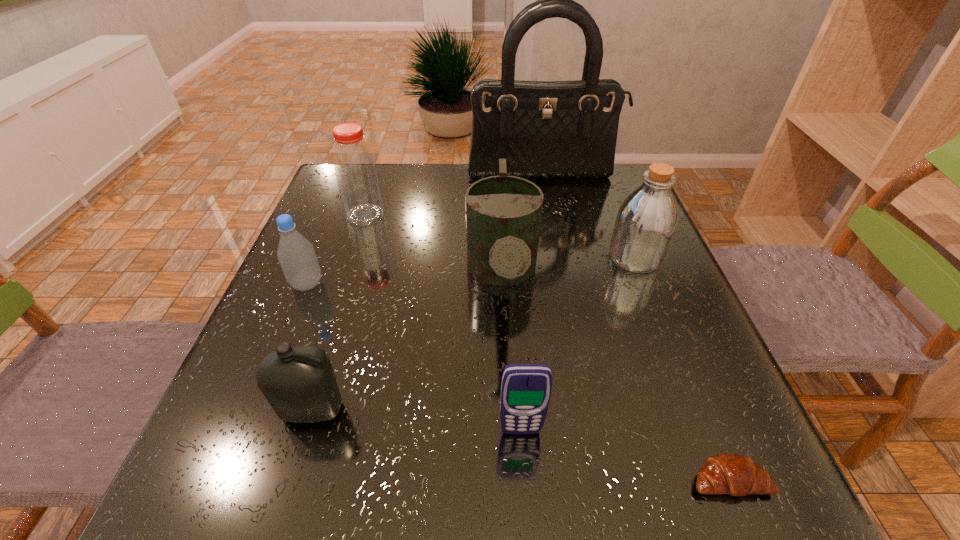
Identify the location of bottle that is at the right edge. Image resolution: width=960 pixels, height=540 pixels. (646, 221).

Find the location of a particular element. Image resolution: width=960 pixels, height=540 pixels. crescent roll present at the right edge is located at coordinates (736, 475).

What are the coordinates of `object situated at the far left corner` in the screenshot? It's located at (356, 174).

I want to click on object that is positioned at the far right corner, so click(x=544, y=129).

Image resolution: width=960 pixels, height=540 pixels. In order to click on object at the near right corner in this screenshot , I will do `click(736, 475)`.

Locate an element on the screen. The height and width of the screenshot is (540, 960). free space at the far edge of the desktop is located at coordinates (445, 189).

Where is `free space at the near edge of the desktop`? This screenshot has width=960, height=540. free space at the near edge of the desktop is located at coordinates (540, 468).

At what (x,y) coordinates should I click in order to perform the action: click on vacant region at the left edge of the desktop. Please return your answer as a coordinate pair (x, y). This screenshot has width=960, height=540. Looking at the image, I should click on (348, 279).

At what (x,y) coordinates should I click in order to perform the action: click on free point at the right edge. Please return your answer as a coordinate pair (x, y). The width and height of the screenshot is (960, 540). Looking at the image, I should click on (612, 272).

This screenshot has width=960, height=540. I want to click on free space at the far left corner of the desktop, so click(x=384, y=164).